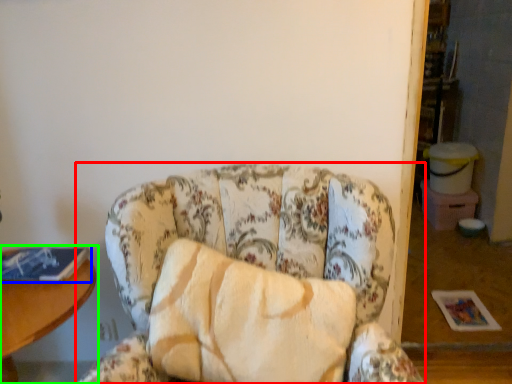
Question: Estimate the real-world distances between objects in this image. Which object is farther from chair (highlighted by a red box), book (highlighted by a blue box) or table (highlighted by a green box)?

Choices:
 (A) book
 (B) table

Answer: (A)